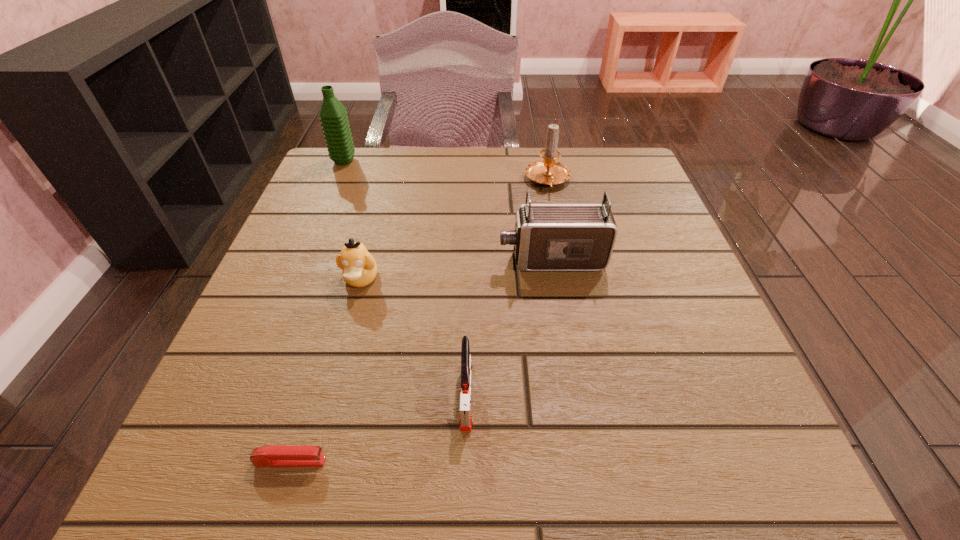
Where is `vacant space at the far right corner of the desktop`? This screenshot has width=960, height=540. vacant space at the far right corner of the desktop is located at coordinates (612, 185).

I want to click on vacant space at the near right corner of the desktop, so click(x=660, y=436).

Where is `vacant area between the farther stapler and the candle`? vacant area between the farther stapler and the candle is located at coordinates (507, 288).

Where is `unoccupied area between the leftmost object and the duckling`? unoccupied area between the leftmost object and the duckling is located at coordinates (352, 220).

Find the location of a particular element. free point between the nearest object and the duckling is located at coordinates (325, 370).

Find the location of a particular element. vacant area that lies between the camcorder and the nearest object is located at coordinates (421, 361).

Find the location of a particular element. The height and width of the screenshot is (540, 960). empty space between the right stapler and the candle is located at coordinates (507, 288).

I want to click on vacant space that is in between the leftmost object and the third object from right to left, so click(405, 278).

This screenshot has width=960, height=540. I want to click on vacant area that lies between the duckling and the right stapler, so click(x=414, y=337).

The height and width of the screenshot is (540, 960). I want to click on vacant area that lies between the third object from right to left and the leftmost object, so click(405, 278).